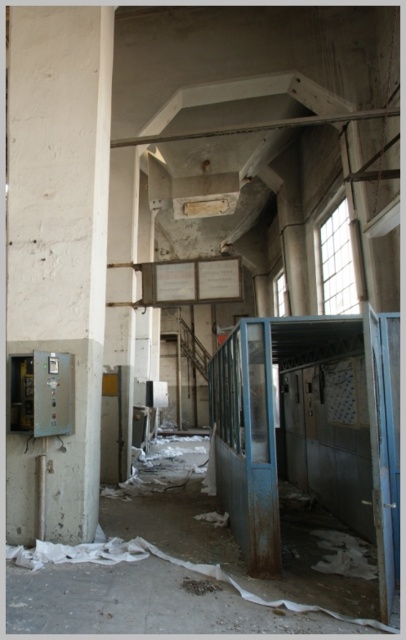
Is point (88, 131) farther from viewer compared to point (196, 582)?

Yes, it is.

Does white concrete pillar at left have a greater height compared to rusty metal debris at center?

Yes.

Locate an element on the screen. white concrete pillar at left is located at coordinates [x=58, y=243].